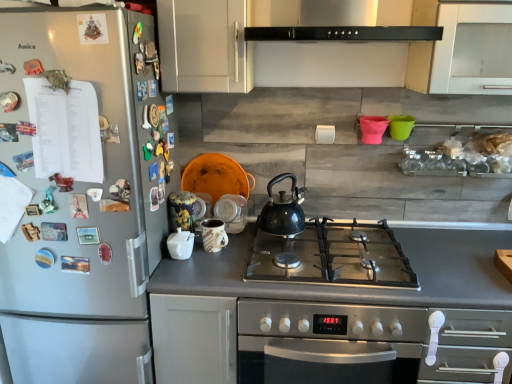
Image resolution: width=512 pixels, height=384 pixels. In order to click on free spot below black matte kettle at center (from a real-world perspective) in this screenshot , I will do pos(288,237).